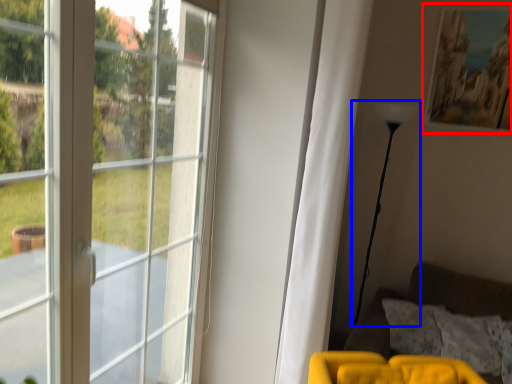
Question: Which object is further to the camera taking this photo, picture frame (highlighted by a red box) or lamp (highlighted by a blue box)?

Choices:
 (A) picture frame
 (B) lamp

Answer: (A)